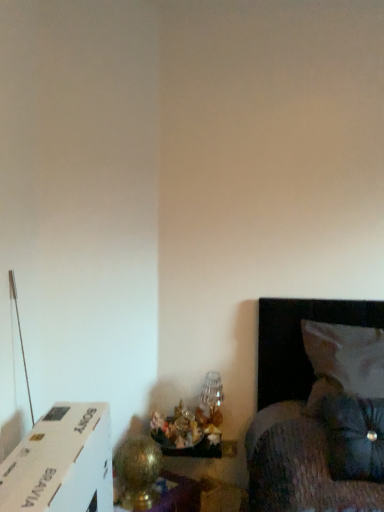
Question: Which direction should I rotate to look at translucent glass vase at lower center, which ranks as the first table lamp in back-to-front order?

Choices:
 (A) right
 (B) left

Answer: (A)

Question: Is translucent glass vase at lower center, marked as the second table lamp in a front-to-back arrangement, oriented away from gold metallic table lamp at lower left, the 1th table lamp in the front-to-back sequence?

Choices:
 (A) yes
 (B) no

Answer: (B)

Question: Is translucent glass vase at lower center, marked as the second table lamp in a front-to-back arrangement, completely or partially outside of gold metallic table lamp at lower left, the 1th table lamp in the front-to-back sequence?

Choices:
 (A) no
 (B) yes

Answer: (B)

Question: Is translucent glass vase at lower center, which ranks as the first table lamp in back-to-front order, to the right of gold metallic table lamp at lower left, the 1th table lamp in the front-to-back sequence, from the viewer's perspective?

Choices:
 (A) no
 (B) yes

Answer: (B)

Question: From a real-world perspective, is translucent glass vase at lower center, the 2th table lamp viewed from the left, beneath gold metallic table lamp at lower left, acting as the second table lamp starting from the right?

Choices:
 (A) no
 (B) yes

Answer: (A)

Question: Does translucent glass vase at lower center, the first table lamp when ordered from right to left, appear on the left side of gold metallic table lamp at lower left, which is counted as the second table lamp, starting from the back?

Choices:
 (A) no
 (B) yes

Answer: (A)

Question: Would you say gold metallic table lamp at lower left, acting as the second table lamp starting from the right, is part of translucent glass vase at lower center, marked as the second table lamp in a front-to-back arrangement,'s contents?

Choices:
 (A) yes
 (B) no

Answer: (B)

Question: Is velvety black pillow at lower right, which is the 1th pillow from front to back, positioned behind translucent glass vase at lower center, marked as the second table lamp in a front-to-back arrangement?

Choices:
 (A) yes
 (B) no

Answer: (B)

Question: From a real-world perspective, does velvety black pillow at lower right, placed as the second pillow when sorted from back to front, stand above translucent glass vase at lower center, which ranks as the first table lamp in back-to-front order?

Choices:
 (A) no
 (B) yes

Answer: (B)

Question: Is velvety black pillow at lower right, placed as the second pillow when sorted from back to front, facing towards translucent glass vase at lower center, the first table lamp when ordered from right to left?

Choices:
 (A) no
 (B) yes

Answer: (A)

Question: Can you confirm if velvety black pillow at lower right, placed as the second pillow when sorted from back to front, is positioned to the left of translucent glass vase at lower center, the 2th table lamp viewed from the left?

Choices:
 (A) no
 (B) yes

Answer: (A)

Question: Is there a large distance between velvety black pillow at lower right, which is the 1th pillow from front to back, and translucent glass vase at lower center, the 2th table lamp viewed from the left?

Choices:
 (A) no
 (B) yes

Answer: (A)

Question: Is translucent glass vase at lower center, the 2th table lamp viewed from the left, at the back of velvety black pillow at lower right, placed as the second pillow when sorted from back to front?

Choices:
 (A) no
 (B) yes

Answer: (A)

Question: Is translucent glass vase at lower center, the first table lamp when ordered from right to left, looking in the opposite direction of velvety black pillow at lower right, which is the 1th pillow from front to back?

Choices:
 (A) no
 (B) yes

Answer: (A)